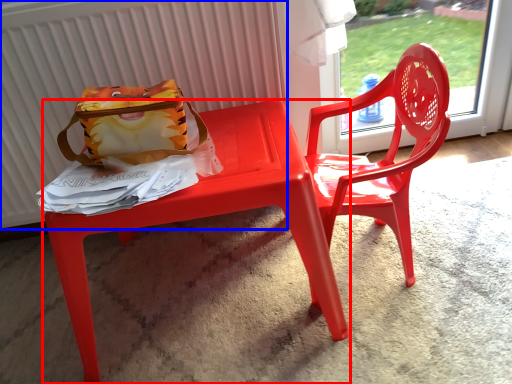
Question: Which object is closer to the camera taking this photo, table (highlighted by a red box) or radiator (highlighted by a blue box)?

Choices:
 (A) table
 (B) radiator

Answer: (A)